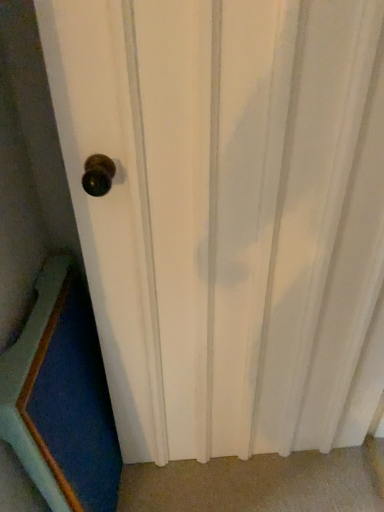
Question: Should I look upward or downward to see blue fabric radiator at lower left?

Choices:
 (A) down
 (B) up

Answer: (A)